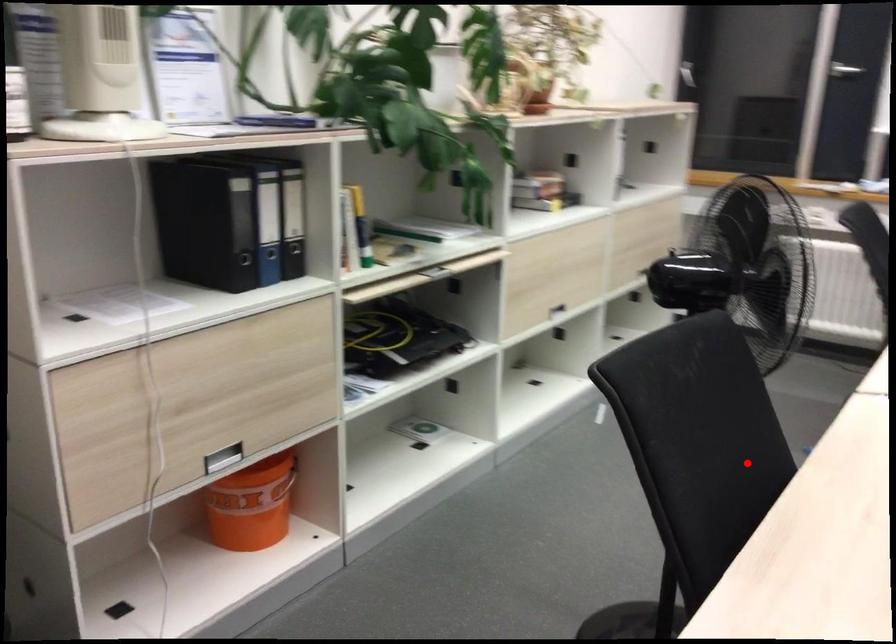
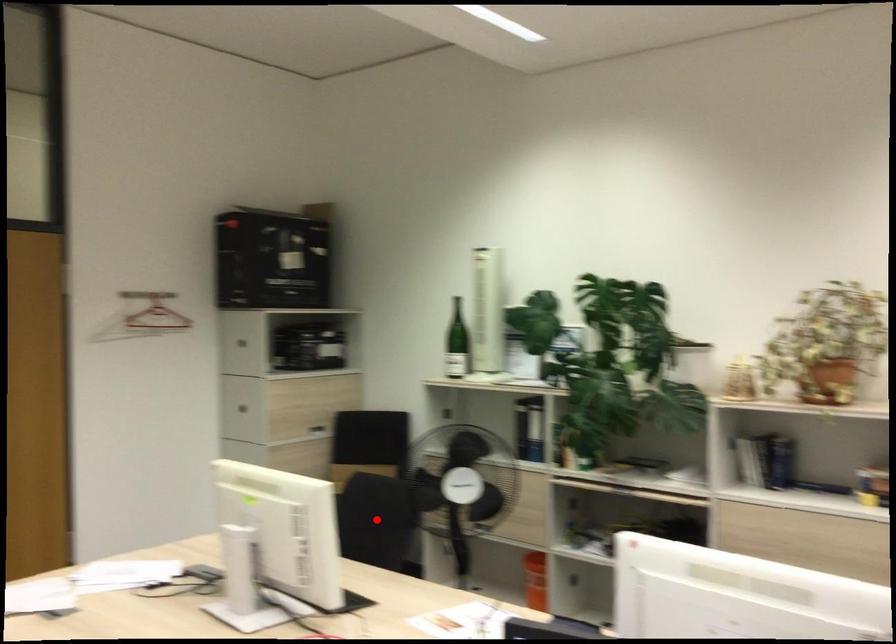
I am providing you with two images of the same scene from different viewpoints. A red point is marked on the first image and another point is marked on the second image. Do the highlighted points in image1 and image2 indicate the same real-world spot?

Yes